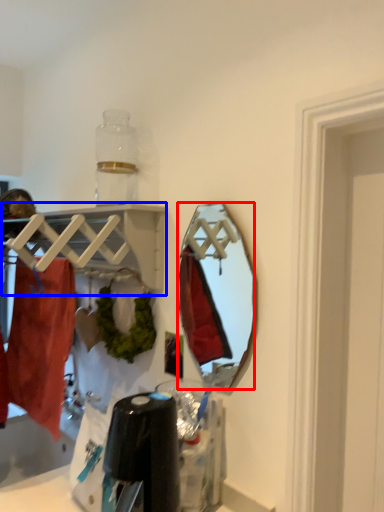
Question: Which object is further to the camera taking this photo, mirror (highlighted by a red box) or shelf (highlighted by a blue box)?

Choices:
 (A) mirror
 (B) shelf

Answer: (A)